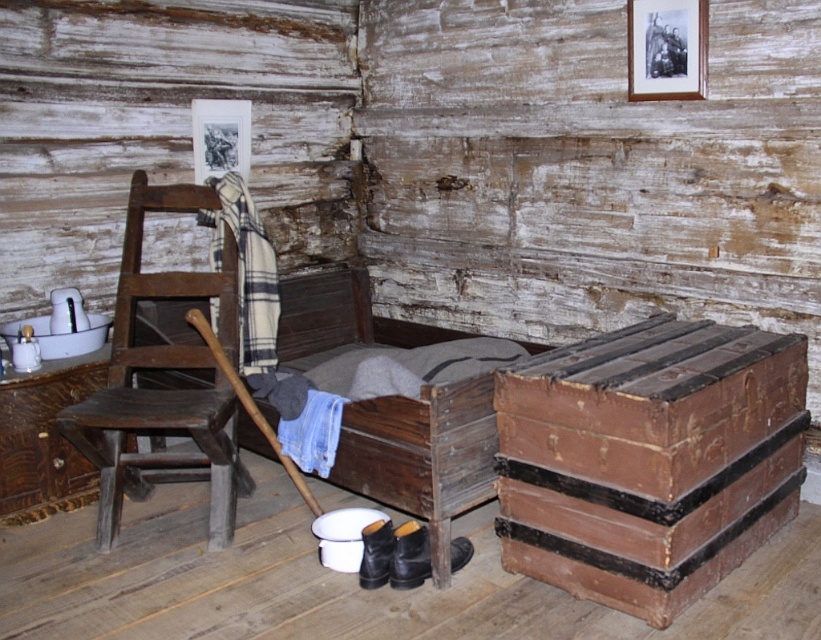
You are an interior designer assessing the placement of two frames in a rustic room. The wooden picture frame at upper right and the black matte picture frame at upper left are both on the wall. Which frame is positioned to the right of the other?

The wooden picture frame at upper right is to the right of the black matte picture frame at upper left.

You are moving into this rustic room and need to place a large piece of furniture. You have the brown leather trunk at lower right and the wooden bed at center. Which one should you choose if you want to place the larger item near the entrance?

The brown leather trunk at lower right is larger in size than the wooden bed at center, so you should choose the brown leather trunk at lower right to place near the entrance as it is the larger item.

You are a traveler carrying a large backpack that requires 60 centimeters of space to maneuver. You see the brown leather trunk at lower right and the wooden bed at center. Can you move between them without bumping into either?

The brown leather trunk at lower right and wooden bed at center are 62.23 centimeters apart from each other. Since your backpack requires 60 centimeters of space, you have enough clearance to move between them without bumping into either.